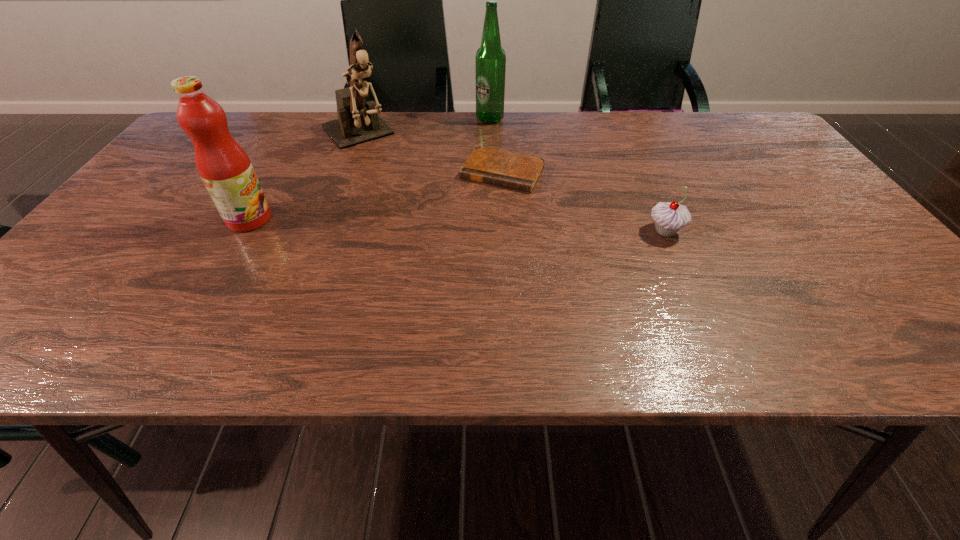
In the image, there is a desktop. What are the coordinates of `vacant space at the far edge` in the screenshot? It's located at (478, 121).

The height and width of the screenshot is (540, 960). I want to click on blank space at the near edge, so (295, 286).

In the image, there is a desktop. Where is `vacant space at the right edge`? This screenshot has height=540, width=960. vacant space at the right edge is located at coordinates (831, 253).

Identify the location of vacant space at the far right corner. (739, 139).

What are the coordinates of `free space at the near right corner of the desktop` in the screenshot? It's located at (866, 287).

Locate an element on the screen. The height and width of the screenshot is (540, 960). free point between the beer bottle and the leftmost object is located at coordinates (370, 169).

I want to click on free area in between the shortest object and the beer bottle, so tap(496, 145).

Locate an element on the screen. The height and width of the screenshot is (540, 960). blank region between the cupcake and the diary is located at coordinates (584, 202).

Locate an element on the screen. vacant area that lies between the diary and the fruit juice is located at coordinates (376, 195).

In order to click on empty space that is in between the leftmost object and the figurine in this screenshot , I will do `click(302, 177)`.